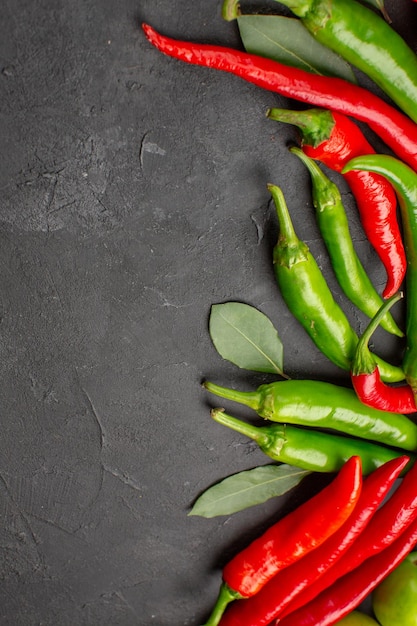
Image resolution: width=417 pixels, height=626 pixels. In order to click on dark gray table in this screenshot , I will do `click(95, 61)`.